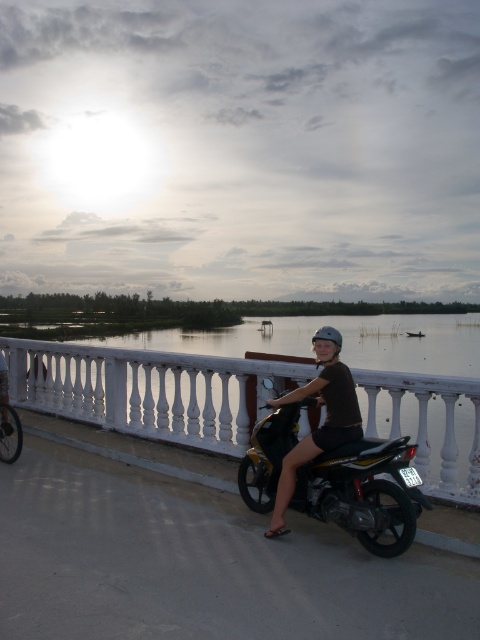
You are a photographer planning to take a wide shot of the scene. You need to ensure that both the shiny metallic motorcycle at center and the matte black helmet at upper center are fully visible in the frame. Given their sizes, which object might require you to adjust your camera angle to avoid cropping?

The shiny metallic motorcycle at center is wider than the matte black helmet at upper center, so the motorcycle may require adjusting the camera angle to ensure it fits entirely within the frame without cropping.

You are a photographer trying to capture the perfect shot of the matte black helmet at upper center and the metallic silver bicycle at center. Since you want to highlight both objects equally, which one should you zoom in on more to ensure they appear the same size in the photo?

The matte black helmet at upper center is larger in size compared to the metallic silver bicycle at center. To make them appear the same size in the photo, you should zoom in more on the metallic silver bicycle at center so that it fills the frame appropriately, balancing its size with the already larger helmet.

You are a photographer trying to capture the shiny metallic motorcycle at center and the matte black helmet at upper center in a single shot. Given that your camera can only focus on one object clearly at a time, which object should you focus on to ensure it appears larger in the photo?

The shiny metallic motorcycle at center is bigger than the matte black helmet at upper center, so focusing on the motorcycle will ensure it appears larger in the photo.